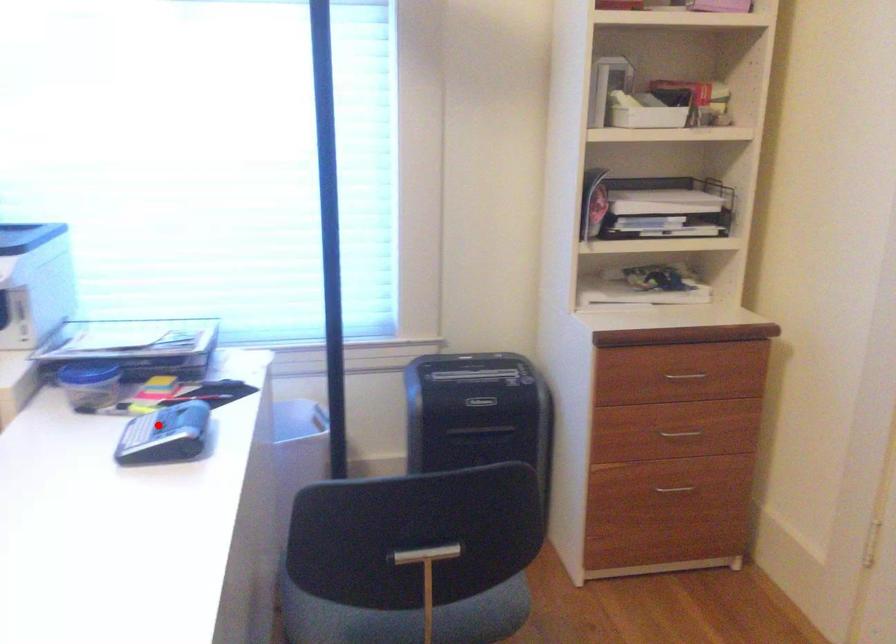
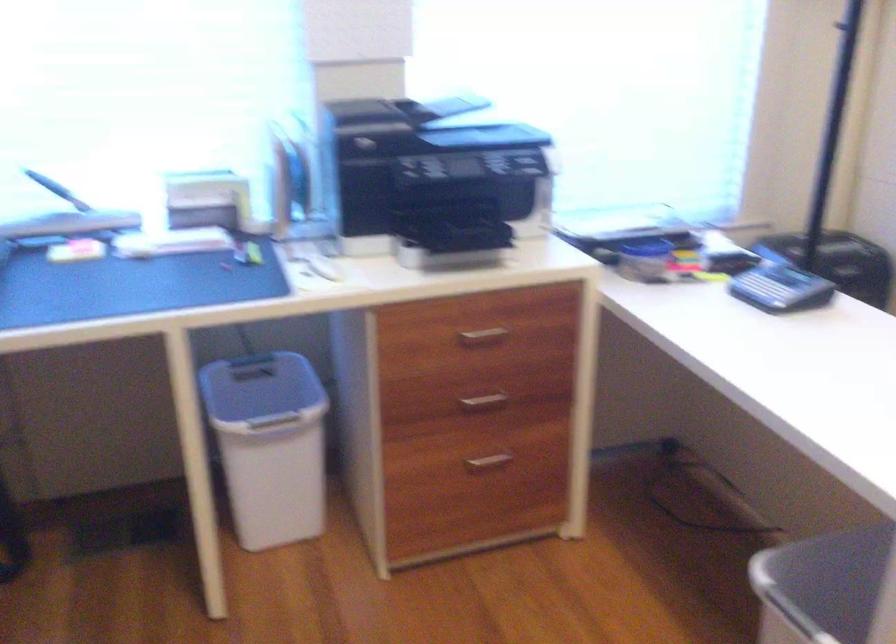
Find the pixel in the second image that matches the highlighted location in the first image.

(763, 289)